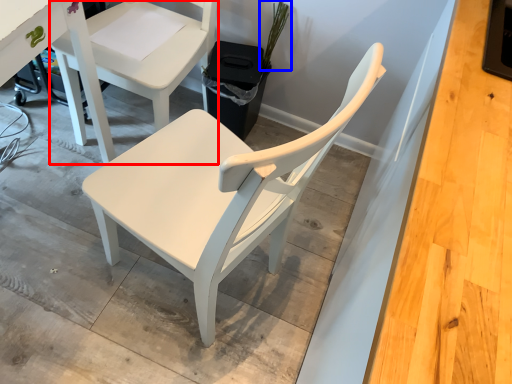
Question: Among these objects, which one is nearest to the camera, chair (highlighted by a red box) or plant (highlighted by a blue box)?

Choices:
 (A) chair
 (B) plant

Answer: (A)